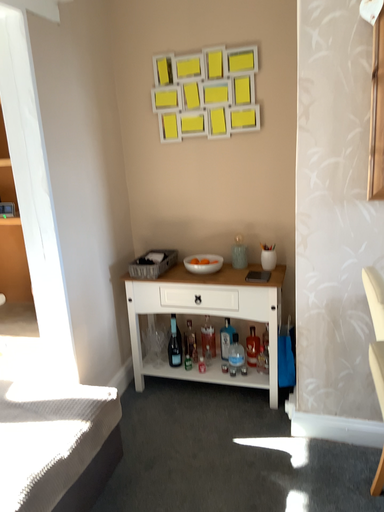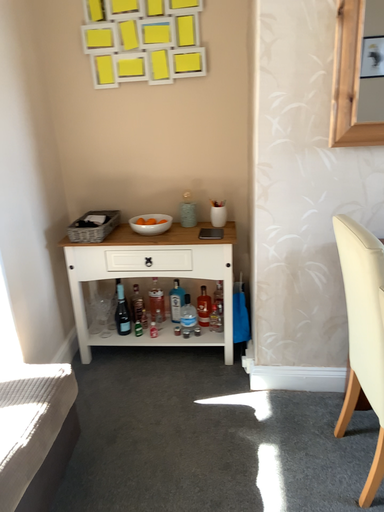
Question: Which way did the camera rotate in the video?

Choices:
 (A) rotated left
 (B) rotated right

Answer: (B)